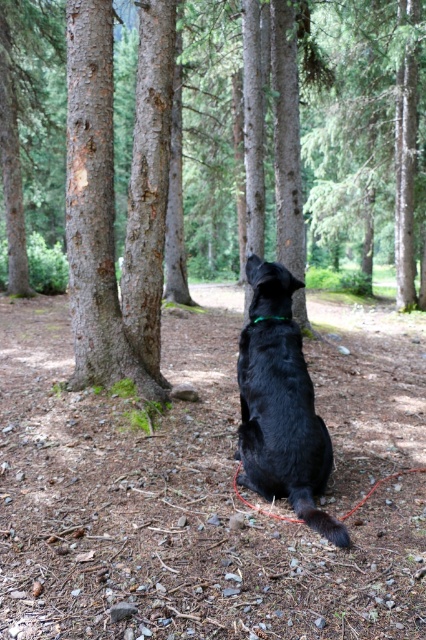
You are standing at the point marked by the coordinates point (112, 198) in the forest. Which direction should you walk to reach the rough bark trees at left?

The point (112, 198) is already at the location of the rough bark trees at left, so you are already there.

You are a wildlife photographer trying to capture a clear shot of the shiny black dog at center and the green fabric neckband at center. Since you want both subjects in focus, you need to know their height relationship. Which one is taller?

The shiny black dog at center is taller than the green fabric neckband at center.